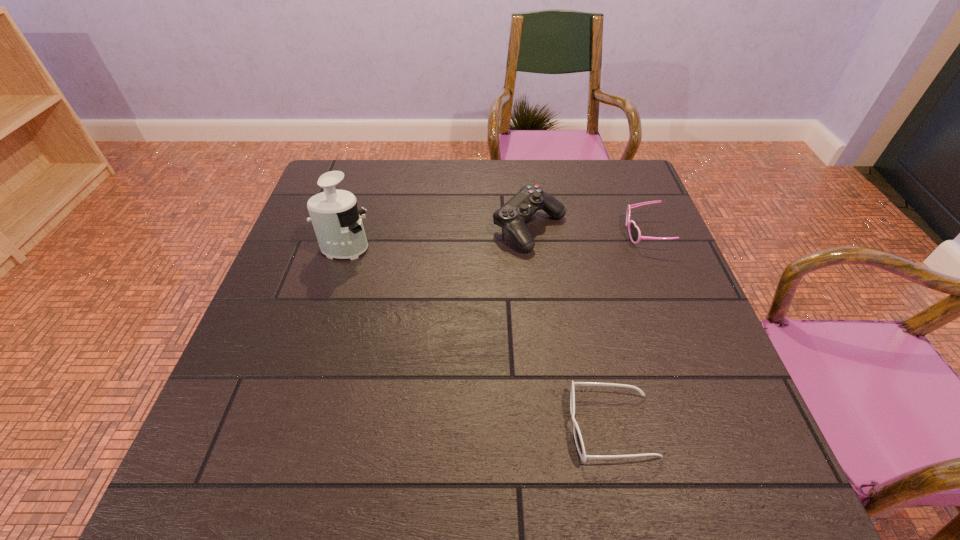
You are a GUI agent. You are given a task and a screenshot of the screen. Output one action in this format:
    pyautogui.click(x=<x>, y=<y>)
    Task: Click on the vacant space at the near edge of the desktop
    The width and height of the screenshot is (960, 540).
    Given the screenshot: What is the action you would take?
    pos(622,490)

In order to click on blank space at the left edge of the desktop in this screenshot , I will do `click(278, 308)`.

Find the location of a particular element. blank area at the right edge is located at coordinates (616, 233).

I want to click on free spot at the far right corner of the desktop, so click(590, 172).

Locate an element on the screen. This screenshot has width=960, height=540. vacant area between the leftmost object and the third shortest object is located at coordinates (437, 239).

I want to click on free space that is in between the farther sunglasses and the control, so click(x=587, y=231).

Where is `free space between the farther sunglasses and the control`? This screenshot has height=540, width=960. free space between the farther sunglasses and the control is located at coordinates (587, 231).

This screenshot has width=960, height=540. In order to click on free area in between the nearer sunglasses and the farther sunglasses in this screenshot , I will do `click(628, 330)`.

Find the location of a particular element. The image size is (960, 540). unoccupied area between the rightmost object and the shortest object is located at coordinates (628, 330).

Image resolution: width=960 pixels, height=540 pixels. What are the coordinates of `free space that is in between the shorter sunglasses and the juicer` in the screenshot? It's located at (478, 338).